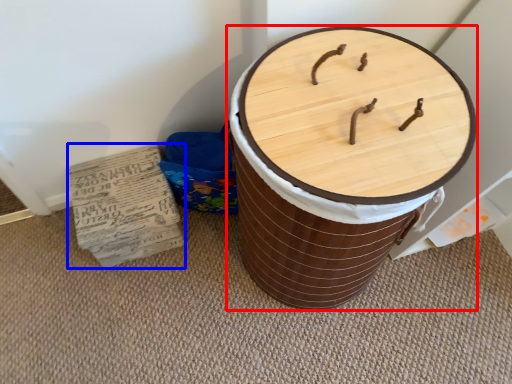
Question: Among these objects, which one is farthest to the camera, furniture (highlighted by a red box) or cardboard (highlighted by a blue box)?

Choices:
 (A) furniture
 (B) cardboard

Answer: (B)